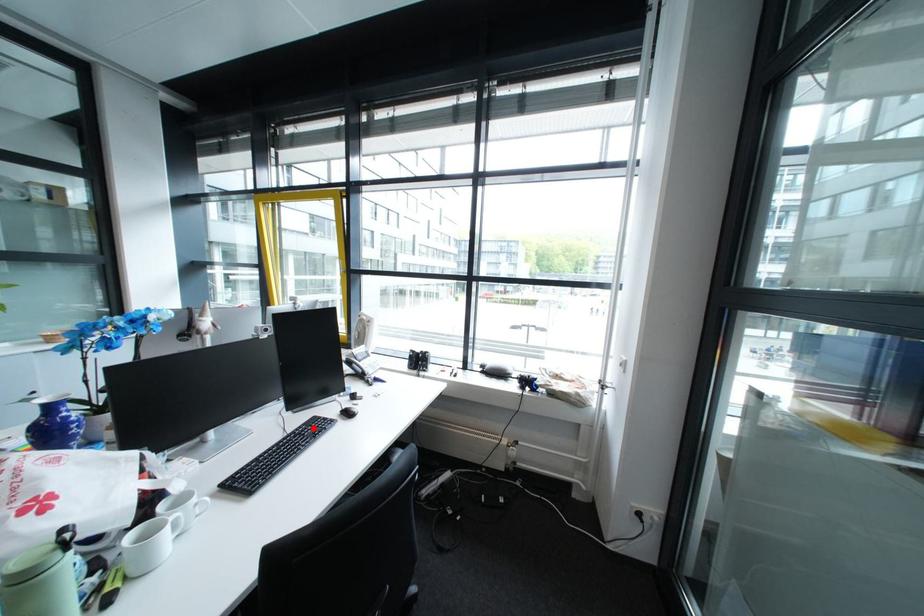
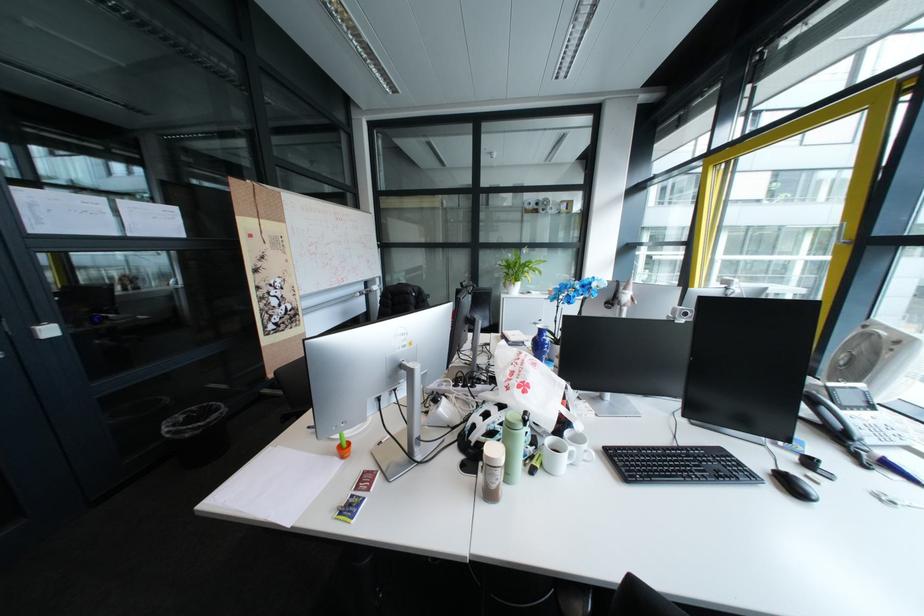
In the second image, find the point that corresponds to the highlighted location in the first image.

(710, 448)